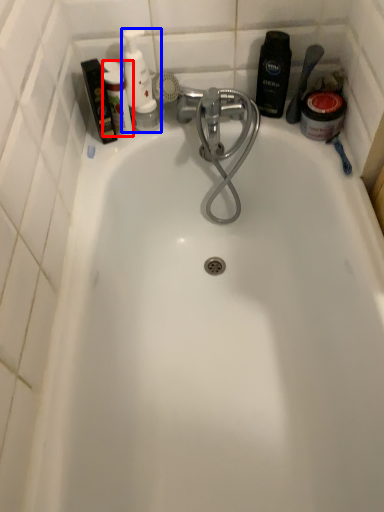
Question: Which point is closer to the camera, toiletry (highlighted by a red box) or toiletry (highlighted by a blue box)?

Choices:
 (A) toiletry
 (B) toiletry

Answer: (A)